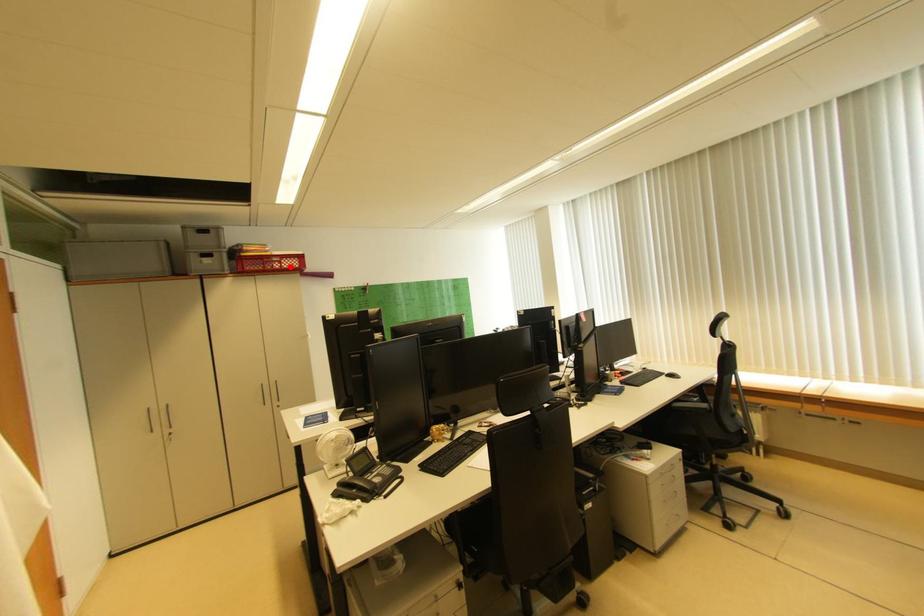
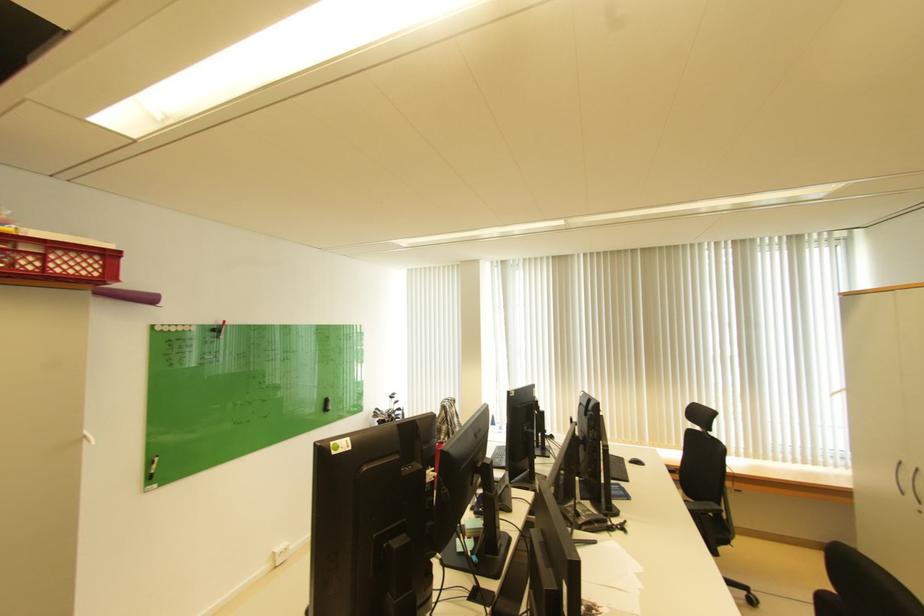
Locate, in the second image, the point that corresponds to the highlighted location in the first image.

(54, 268)